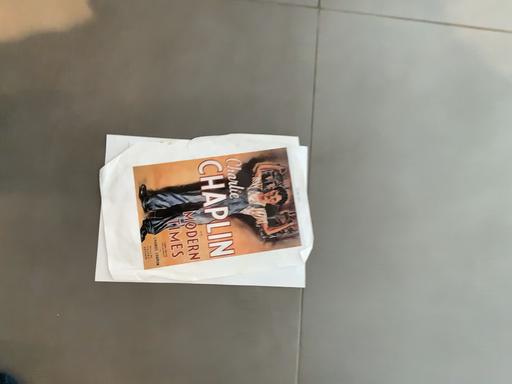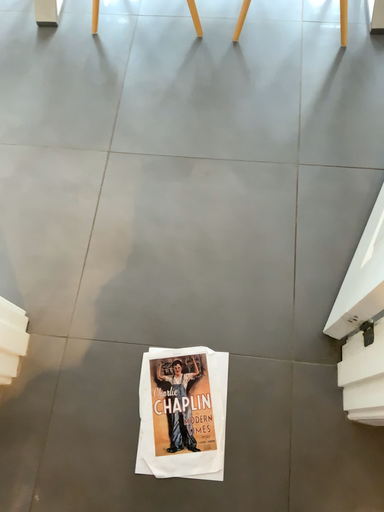
Question: How did the camera likely rotate when shooting the video?

Choices:
 (A) rotated upward
 (B) rotated downward

Answer: (A)